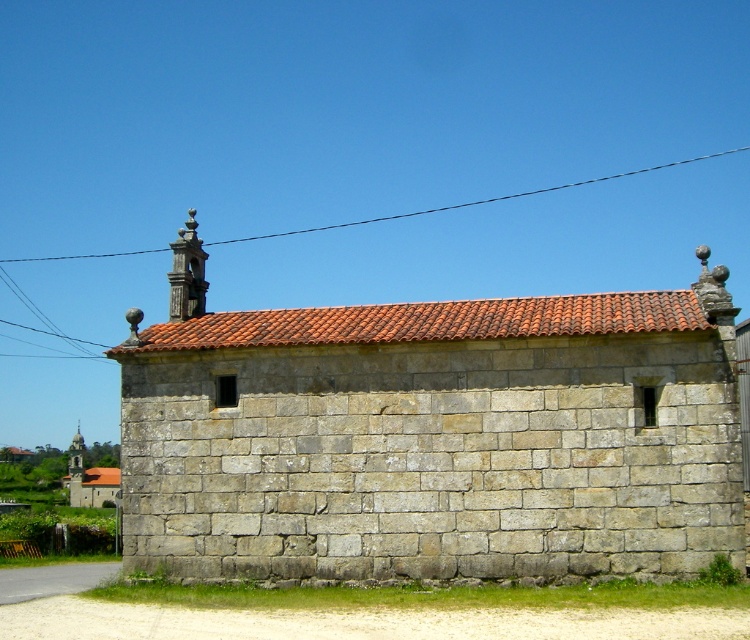
Question: Is black wire at upper center closer to camera compared to stone church at left?

Choices:
 (A) no
 (B) yes

Answer: (A)

Question: Which point is farther to the camera?

Choices:
 (A) gray stone chapel at center
 (B) black wire at upper center
 (C) stone church at left

Answer: (B)

Question: Is gray stone chapel at center to the right of stone church at left from the viewer's perspective?

Choices:
 (A) no
 (B) yes

Answer: (B)

Question: Among these objects, which one is farthest from the camera?

Choices:
 (A) black wire at upper center
 (B) stone church at left

Answer: (A)

Question: Is gray stone chapel at center closer to camera compared to stone church at left?

Choices:
 (A) no
 (B) yes

Answer: (B)

Question: Which object is the farthest from the black wire at upper center?

Choices:
 (A) stone church at left
 (B) gray stone chapel at center

Answer: (B)